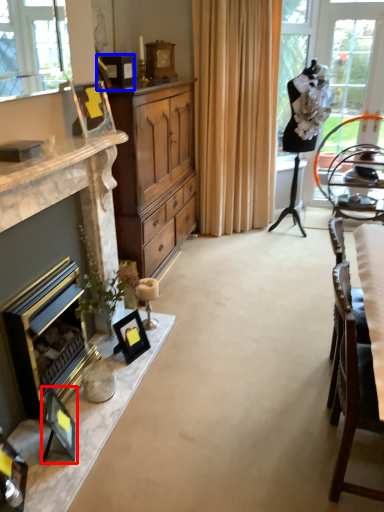
Question: Which object appears closest to the camera in this image, picture frame (highlighted by a red box) or picture frame (highlighted by a blue box)?

Choices:
 (A) picture frame
 (B) picture frame

Answer: (A)